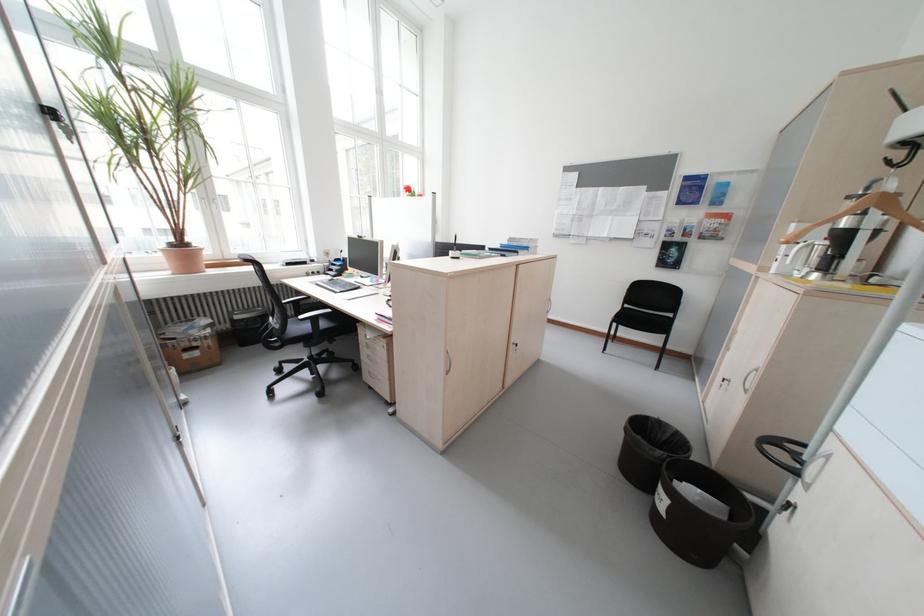
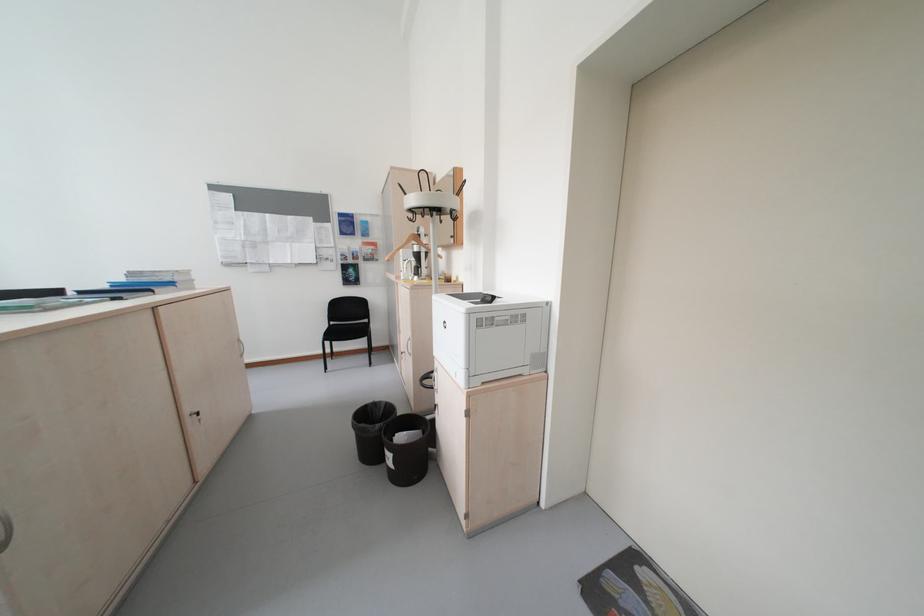
Find the pixel in the second image that matches the point at 523,347 in the first image.

(200, 421)